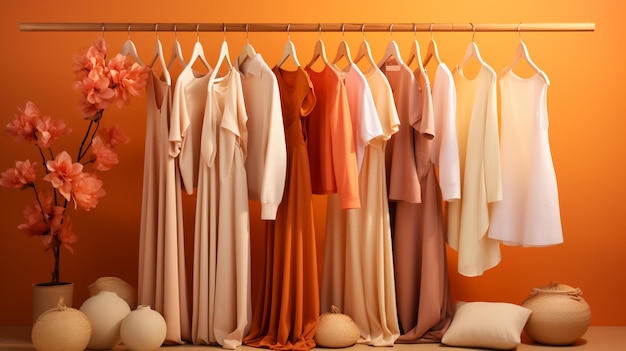
In order to click on circular decorative items on floor in this screenshot , I will do `click(342, 333)`, `click(146, 328)`, `click(106, 305)`, `click(64, 330)`, `click(573, 321)`.